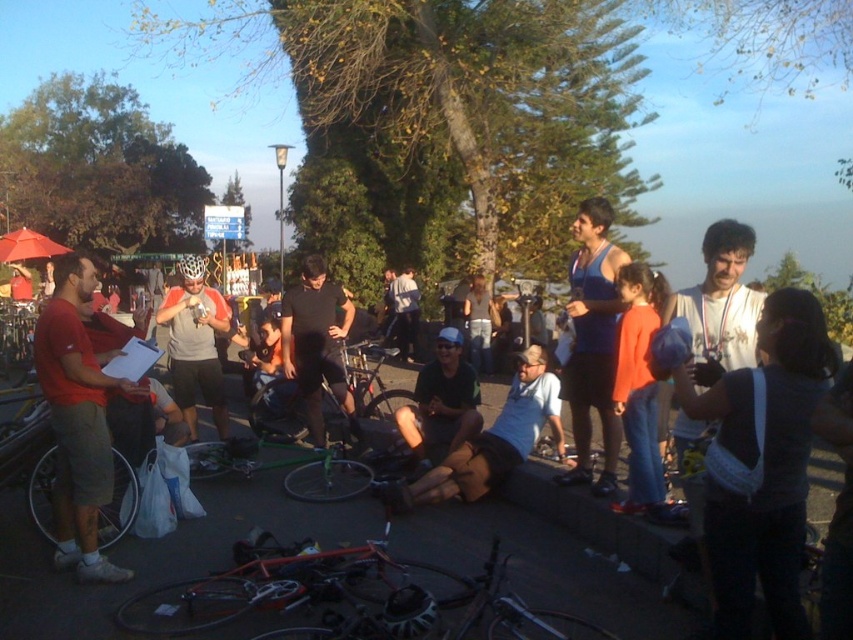
Question: Does red matte bicycle at lower center appear on the right side of dark blue jeans at center?

Choices:
 (A) no
 (B) yes

Answer: (A)

Question: Among these objects, which one is nearest to the camera?

Choices:
 (A) matte red shirt at left
 (B) black matte shirt at center

Answer: (A)

Question: Considering the relative positions of orange cotton shirt at center and matte black bicycle at left in the image provided, where is orange cotton shirt at center located with respect to matte black bicycle at left?

Choices:
 (A) right
 (B) left

Answer: (A)

Question: Estimate the real-world distances between objects in this image. Which object is closer to the red matte bicycle at lower center?

Choices:
 (A) blue tank top at center
 (B) green metallic bicycle at center
 (C) dark blue jeans at center
 (D) matte gray helmet at center

Answer: (A)

Question: Does blue tank top at center come behind green fabric shorts at center?

Choices:
 (A) yes
 (B) no

Answer: (B)

Question: Which point appears closest to the camera in this image?

Choices:
 (A) (628, 369)
 (B) (399, 433)
 (C) (210, 394)
 (D) (338, 413)

Answer: (A)